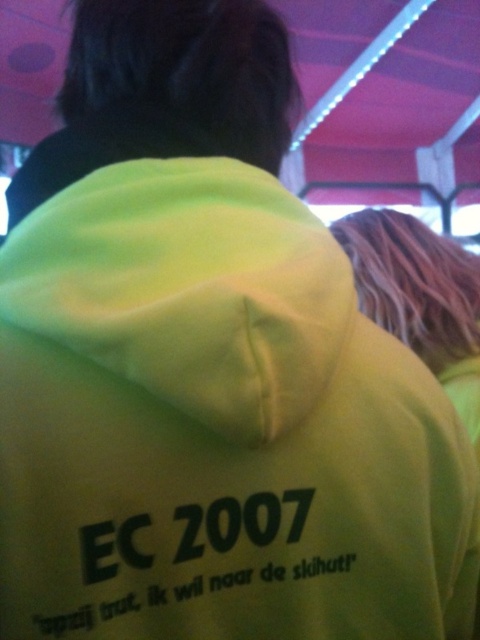
You are a photographer trying to capture the scene with the matte pink canopy at upper center. Where exactly should you position the canopy in your camera frame?

The matte pink canopy at upper center should be positioned at point coordinates 0.155 on the x axis and 0.835 on the y axis.

You are a photographer trying to capture the neon yellow hoodie at upper right and the matte pink canopy at upper center in the same frame. Based on their positions, which object should you adjust your camera to focus on first to ensure both are in the shot?

The matte pink canopy at upper center is to the right of the neon yellow hoodie at upper right, so you should focus on the neon yellow hoodie at upper right first to ensure both are in the frame.